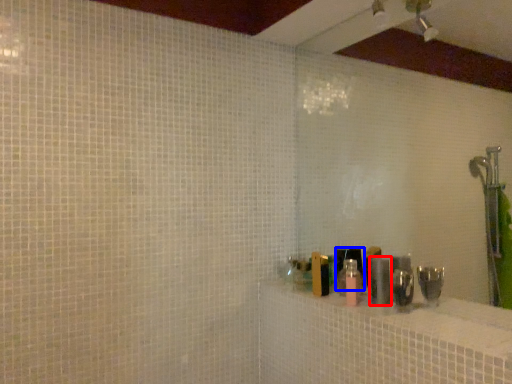
Question: Which object is closer to the camera taking this photo, toiletry (highlighted by a red box) or toiletry (highlighted by a blue box)?

Choices:
 (A) toiletry
 (B) toiletry

Answer: (B)